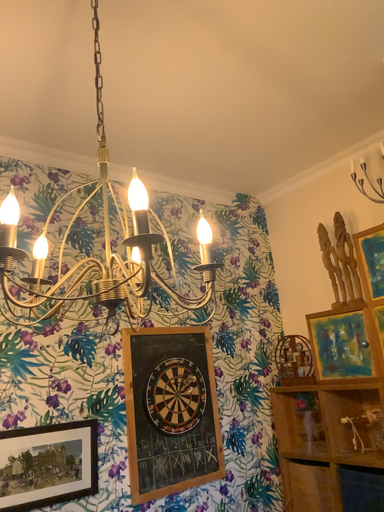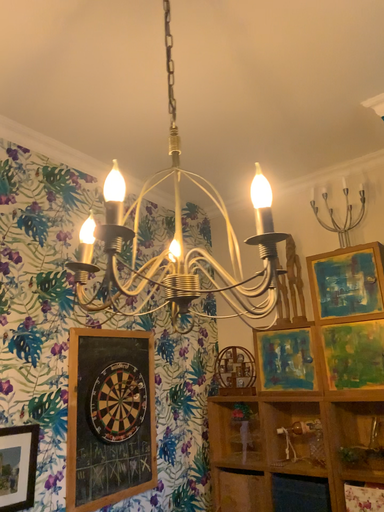
Question: How did the camera likely rotate when shooting the video?

Choices:
 (A) rotated left
 (B) rotated right

Answer: (B)